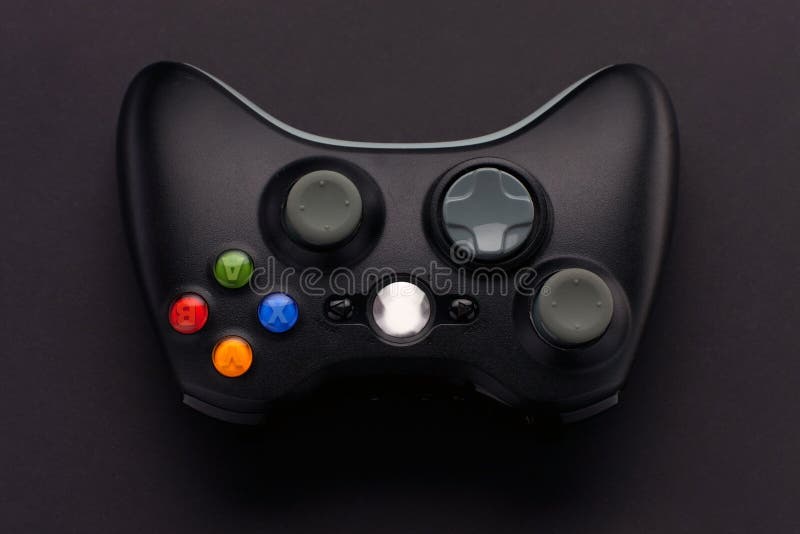
At what (x,y) coordinates should I click in order to perform the action: click on control button. Please return your answer as a coordinate pair (x, y). This screenshot has width=800, height=534. Looking at the image, I should click on (493, 219).